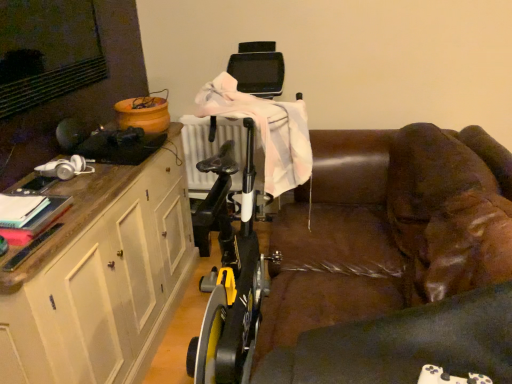
The image size is (512, 384). What are the coordinates of `white wood cabinet at left` in the screenshot? It's located at (102, 276).

Image resolution: width=512 pixels, height=384 pixels. What do you see at coordinates (102, 276) in the screenshot?
I see `white wood cabinet at left` at bounding box center [102, 276].

What are the coordinates of `brown leather couch at center` in the screenshot? It's located at (392, 261).

Describe the element at coordinates (392, 261) in the screenshot. The width and height of the screenshot is (512, 384). I see `brown leather couch at center` at that location.

I want to click on white wood cabinet at left, so click(x=102, y=276).

Which is more to the right, brown leather couch at center or white wood cabinet at left?

From the viewer's perspective, brown leather couch at center appears more on the right side.

Based on the photo, considering the positions of objects brown leather couch at center and white wood cabinet at left in the image provided, who is in front, brown leather couch at center or white wood cabinet at left?

brown leather couch at center is closer to the camera.

Is point (429, 267) positioned behind point (170, 284)?

No, (429, 267) is in front of (170, 284).

From the image's perspective, is brown leather couch at center above or below white wood cabinet at left?

brown leather couch at center is above white wood cabinet at left.

From a real-world perspective, is brown leather couch at center located higher than white wood cabinet at left?

No, from a real-world perspective, brown leather couch at center is not above white wood cabinet at left.

Which object is thinner, brown leather couch at center or white wood cabinet at left?

Thinner between the two is white wood cabinet at left.

Considering the sizes of brown leather couch at center and white wood cabinet at left in the image, is brown leather couch at center taller or shorter than white wood cabinet at left?

In the image, brown leather couch at center appears to be shorter than white wood cabinet at left.

Considering the relative sizes of brown leather couch at center and white wood cabinet at left in the image provided, is brown leather couch at center smaller than white wood cabinet at left?

Incorrect, brown leather couch at center is not smaller in size than white wood cabinet at left.

Is brown leather couch at center positioned beyond the bounds of white wood cabinet at left?

That's correct, brown leather couch at center is outside of white wood cabinet at left.

Is brown leather couch at center next to white wood cabinet at left and touching it?

They are not placed beside each other.

Does brown leather couch at center turn towards white wood cabinet at left?

Yes, brown leather couch at center is oriented towards white wood cabinet at left.

How different are the orientations of brown leather couch at center and white wood cabinet at left in degrees?

The angular difference between brown leather couch at center and white wood cabinet at left is 179 degrees.

Where is `studio couch in front of the white wood cabinet at left`? Image resolution: width=512 pixels, height=384 pixels. studio couch in front of the white wood cabinet at left is located at coordinates (392, 261).

Visually, is white wood cabinet at left positioned to the left or to the right of brown leather couch at center?

In the image, white wood cabinet at left appears on the left side of brown leather couch at center.

Considering the positions of objects white wood cabinet at left and brown leather couch at center in the image provided, who is in front, white wood cabinet at left or brown leather couch at center?

brown leather couch at center is in front.

Does point (145, 199) appear closer or farther from the camera than point (341, 149)?

Point (145, 199) is closer to the camera than point (341, 149).

From the image's perspective, is white wood cabinet at left located above or below brown leather couch at center?

Based on their image positions, white wood cabinet at left is located beneath brown leather couch at center.

From a real-world perspective, which is physically below, white wood cabinet at left or brown leather couch at center?

From a 3D spatial view, brown leather couch at center is below.

Looking at this image, which of these two, white wood cabinet at left or brown leather couch at center, is wider?

Wider between the two is brown leather couch at center.

Consider the image. Who is shorter, white wood cabinet at left or brown leather couch at center?

brown leather couch at center.

Is white wood cabinet at left bigger than brown leather couch at center?

No.

Is white wood cabinet at left situated inside brown leather couch at center or outside?

white wood cabinet at left is spatially situated outside brown leather couch at center.

Is white wood cabinet at left not close to brown leather couch at center?

They are positioned close to each other.

Does white wood cabinet at left turn towards brown leather couch at center?

Yes, white wood cabinet at left is aimed at brown leather couch at center.

Identify the location of studio couch on the right of white wood cabinet at left. (392, 261).

Identify the location of studio couch above the white wood cabinet at left (from the image's perspective). This screenshot has width=512, height=384. (392, 261).

Identify the location of cabinetry below the brown leather couch at center (from the image's perspective). Image resolution: width=512 pixels, height=384 pixels. (102, 276).